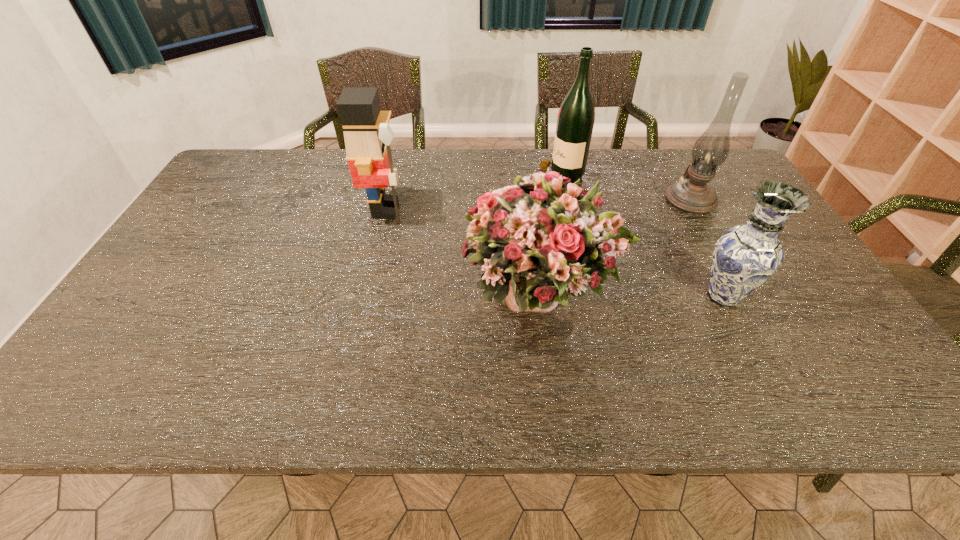
In the image, there is a desktop. Where is `vacant area at the far left corner`? vacant area at the far left corner is located at coordinates (273, 167).

The height and width of the screenshot is (540, 960). Identify the location of empty space that is in between the vase and the bouquet. (633, 295).

Image resolution: width=960 pixels, height=540 pixels. Find the location of `empty space that is in between the vase and the oil lamp`. empty space that is in between the vase and the oil lamp is located at coordinates (707, 248).

Locate an element on the screen. This screenshot has width=960, height=540. free space between the bouquet and the vase is located at coordinates (633, 295).

Locate an element on the screen. Image resolution: width=960 pixels, height=540 pixels. vacant space in between the vase and the wine bottle is located at coordinates (641, 237).

Locate an element on the screen. The height and width of the screenshot is (540, 960). the closest object relative to the bouquet is located at coordinates (745, 256).

Identify which object is the nearest to the wine bottle. Please provide its 2D coordinates. Your answer should be formatted as a tuple, i.e. [(x, y)], where the tuple contains the x and y coordinates of a point satisfying the conditions above.

[(693, 194)]

At what (x,y) coordinates should I click in order to perform the action: click on vacant region that satisfies the following two spatial constraints: 1. on the surface of the wine bottle; 2. on the right side of the oil lamp. Please return your answer as a coordinate pair (x, y). This screenshot has height=540, width=960. Looking at the image, I should click on (565, 200).

You are a GUI agent. You are given a task and a screenshot of the screen. Output one action in this format:
    pyautogui.click(x=<x>, y=<y>)
    Task: Click on the vacant area in the image that satisfies the following two spatial constraints: 1. on the surface of the wine bottle; 2. on the left side of the vase
    The width and height of the screenshot is (960, 540).
    Given the screenshot: What is the action you would take?
    pyautogui.click(x=587, y=297)

What are the coordinates of `vacant space that satisfies the following two spatial constraints: 1. on the surface of the oil lamp; 2. on the left side of the wine bottle` in the screenshot? It's located at (565, 200).